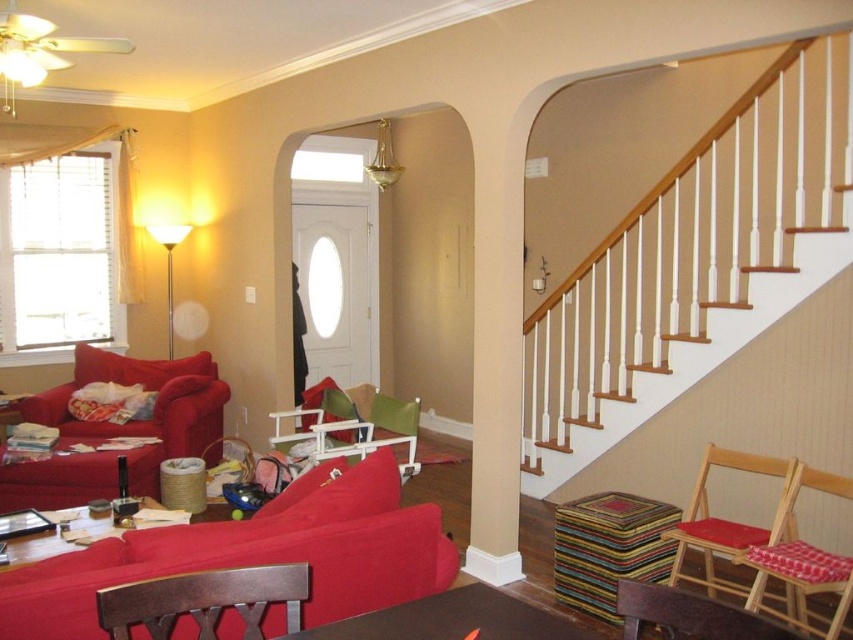
Question: Does wooden folding chair with checkered cushion at right have a lesser width compared to green fabric armchair at center?

Choices:
 (A) yes
 (B) no

Answer: (A)

Question: Among these objects, which one is nearest to the camera?

Choices:
 (A) wooden table at center
 (B) velvet red couch at lower left
 (C) wooden folding chair with checkered cushion at right

Answer: (A)

Question: Is the position of green fabric armchair at center less distant than that of smooth wooden table at lower left?

Choices:
 (A) yes
 (B) no

Answer: (B)

Question: Does matte red couch at left appear on the left side of multicolored woven stool at lower right?

Choices:
 (A) no
 (B) yes

Answer: (B)

Question: Which object is positioned closest to the matte red couch at left?

Choices:
 (A) wooden folding chair at lower right
 (B) smooth wooden table at lower left
 (C) velvet red couch at lower left
 (D) wooden table at center

Answer: (B)

Question: Which of these objects is positioned closest to the velvet red couch at lower left?

Choices:
 (A) wooden stair at upper right
 (B) wooden folding chair at lower right

Answer: (B)